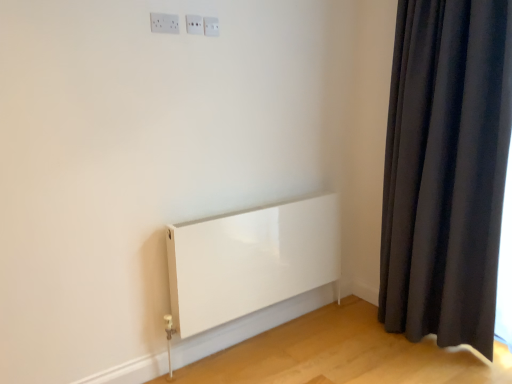
Question: From the image's perspective, is white plastic electric outlet at upper center, which is the third electric outlet in left-to-right order, above or below white plastic electric outlet at upper center, arranged as the 2th electric outlet when viewed from the back?

Choices:
 (A) below
 (B) above

Answer: (B)

Question: Looking at their shapes, would you say white plastic electric outlet at upper center, which is the third electric outlet in left-to-right order, is wider or thinner than white plastic electric outlet at upper center, positioned as the second electric outlet in right-to-left order?

Choices:
 (A) thin
 (B) wide

Answer: (B)

Question: Considering the real-world distances, which object is farthest from the white glossy electric outlet at upper center, the 1th electric outlet positioned from the front?

Choices:
 (A) white plastic electric outlet at upper center, the 1th electric outlet positioned from the right
 (B) white plastic electric outlet at upper center, arranged as the second electric outlet when viewed from the left

Answer: (A)

Question: Which object is the closest to the white plastic electric outlet at upper center, which ranks as the 3th electric outlet in front-to-back order?

Choices:
 (A) white glossy electric outlet at upper center, which appears as the third electric outlet when viewed from the right
 (B) white plastic electric outlet at upper center, arranged as the 2th electric outlet when viewed from the back

Answer: (B)